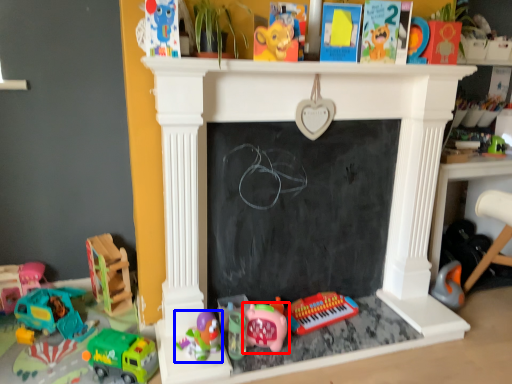
Question: Which object is further to the camera taking this photo, toy (highlighted by a red box) or toy (highlighted by a blue box)?

Choices:
 (A) toy
 (B) toy

Answer: (A)